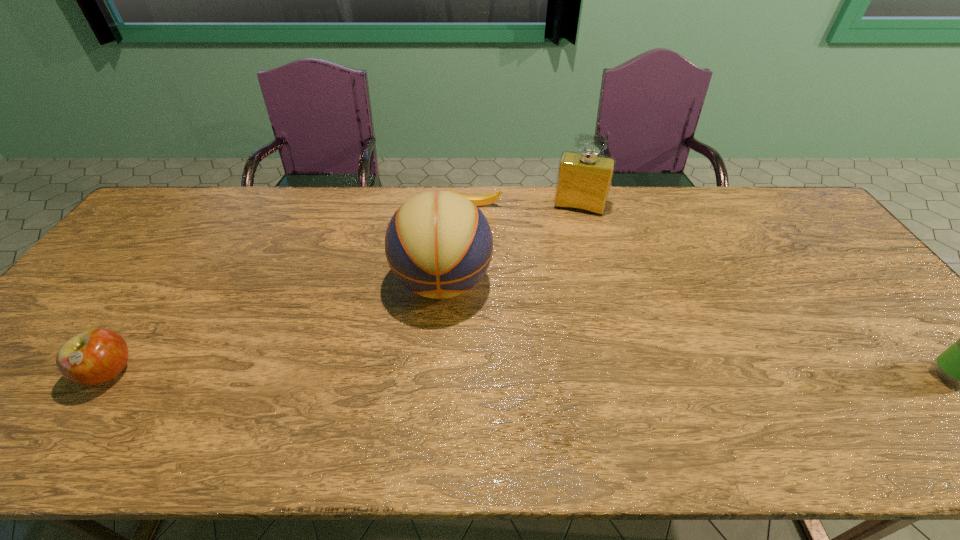
In order to click on vacant area at the far edge of the desktop in this screenshot , I will do `click(662, 213)`.

Image resolution: width=960 pixels, height=540 pixels. What are the coordinates of `free space at the near edge` in the screenshot? It's located at (165, 386).

Where is `free region at the left edge`? Image resolution: width=960 pixels, height=540 pixels. free region at the left edge is located at coordinates (130, 266).

I want to click on vacant region at the right edge of the desktop, so tap(898, 332).

Where is `vacant area that lies between the fourth object from left to right and the apple`? vacant area that lies between the fourth object from left to right and the apple is located at coordinates (344, 290).

At what (x,y) coordinates should I click in order to perform the action: click on empty location between the third nearest object and the fourth object from left to right. Please return your answer as a coordinate pair (x, y). Looking at the image, I should click on (x=511, y=245).

Find the location of `free point between the second object from right to left and the shortest object`. free point between the second object from right to left and the shortest object is located at coordinates (526, 206).

Where is `vacant space that is in between the apple and the perfume`? The height and width of the screenshot is (540, 960). vacant space that is in between the apple and the perfume is located at coordinates (344, 290).

Identify the location of object that is the second closest to the shortest object. The height and width of the screenshot is (540, 960). click(x=438, y=244).

Identify the location of object that ranks as the second closest to the rightmost object. The width and height of the screenshot is (960, 540). (438, 244).